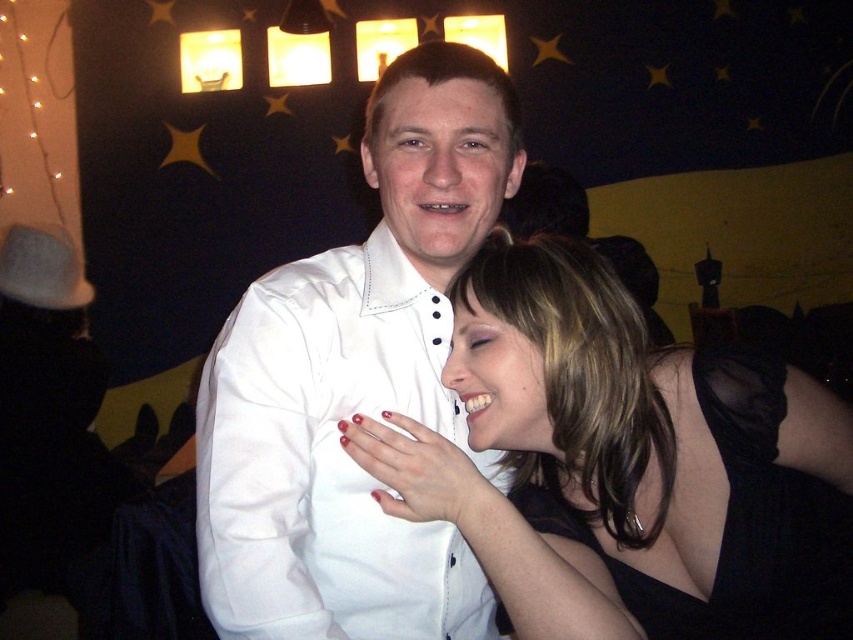
You are a photographer at a social event. You want to take a photo of the two people wearing the satin black dress at center and the white satin shirt at center. What is the minimum distance you need to maintain between the camera and the subjects to ensure both are fully in frame?

The minimum distance required is 6.86 inches to ensure both the satin black dress at center and the white satin shirt at center are fully captured in the frame.

You are a photographer at the event and need to capture both the satin black dress at center and the black satin dress at lower right in a single frame. Which dress should you focus on first to ensure both are in the frame?

You should focus on the satin black dress at center first because it is larger and will require more space in the frame. By centering it, you can adjust the camera angle to include the smaller black satin dress at lower right without cropping either out.